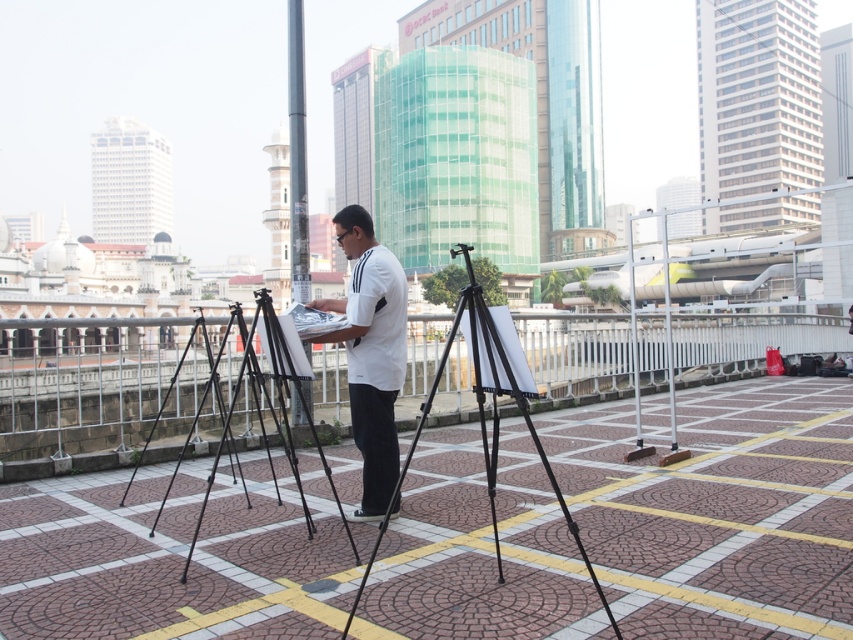
Question: Is white matte shirt at center smaller than black metal pole at center?

Choices:
 (A) yes
 (B) no

Answer: (A)

Question: Estimate the real-world distances between objects in this image. Which object is farther from the black metal pole at center?

Choices:
 (A) black metal tripod at center
 (B) white matte shirt at center

Answer: (A)

Question: Which object is positioned closest to the white matte shirt at center?

Choices:
 (A) black matte tripod at center
 (B) black metal tripod at center
 (C) black metal pole at center

Answer: (A)

Question: Which object is positioned farthest from the black metal pole at center?

Choices:
 (A) white matte shirt at center
 (B) black metal tripod at center

Answer: (B)

Question: Is white matte shirt at center wider than black metal tripod at center?

Choices:
 (A) no
 (B) yes

Answer: (A)

Question: Is the position of white matte shirt at center less distant than that of black matte tripod at center?

Choices:
 (A) yes
 (B) no

Answer: (B)